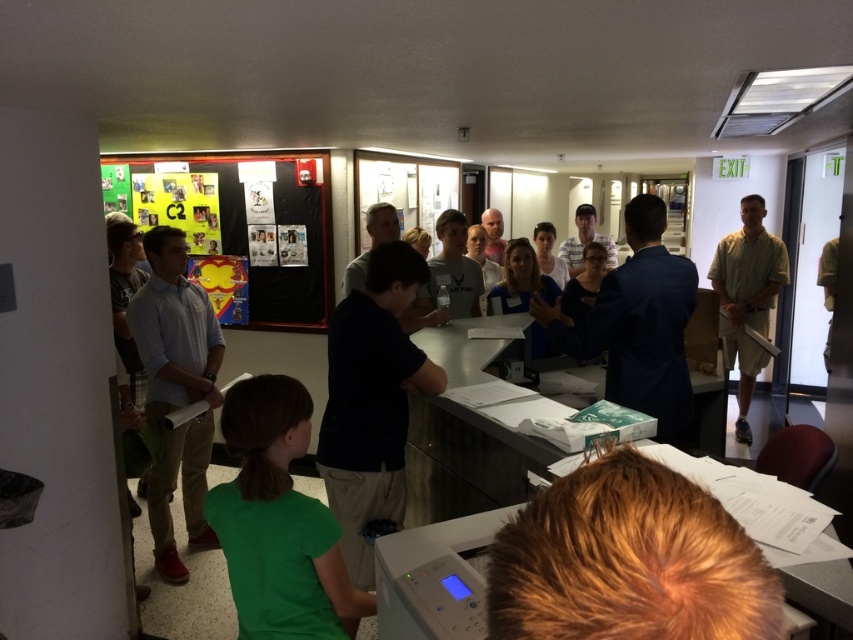
Does green matte shirt at lower left have a lesser width compared to light blue shirt at left?

→ No.

Does green matte shirt at lower left have a greater width compared to light blue shirt at left?

Indeed, green matte shirt at lower left has a greater width compared to light blue shirt at left.

Is point (247, 504) behind point (215, 362)?

No, it is in front of (215, 362).

The image size is (853, 640). In order to click on green matte shirt at lower left in this screenshot , I will do `click(277, 522)`.

Is green matte shirt at lower left in front of multicolored paperboard at upper left?

Yes, it is.

Does green matte shirt at lower left have a greater width compared to multicolored paperboard at upper left?

Incorrect, green matte shirt at lower left's width does not surpass multicolored paperboard at upper left's.

Find the location of a particular element. green matte shirt at lower left is located at coordinates (277, 522).

Image resolution: width=853 pixels, height=640 pixels. I want to click on green matte shirt at lower left, so click(x=277, y=522).

Is point (189, 516) positioned before point (276, 316)?

That is True.

Between point (219, 337) and point (312, 314), which one is positioned behind?

Positioned behind is point (312, 314).

This screenshot has height=640, width=853. I want to click on light blue shirt at left, so click(x=177, y=390).